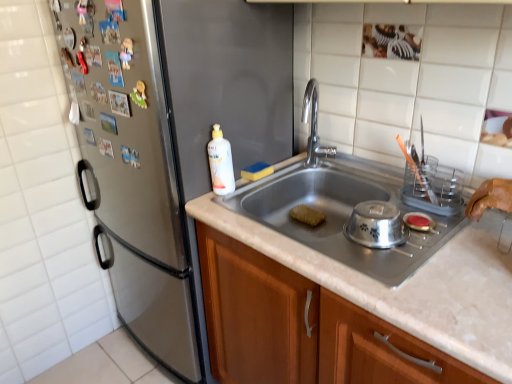
Find the location of a particular element. free spot in front of yellow sponge at sink, which ranks as the second food in right-to-left order is located at coordinates (240, 194).